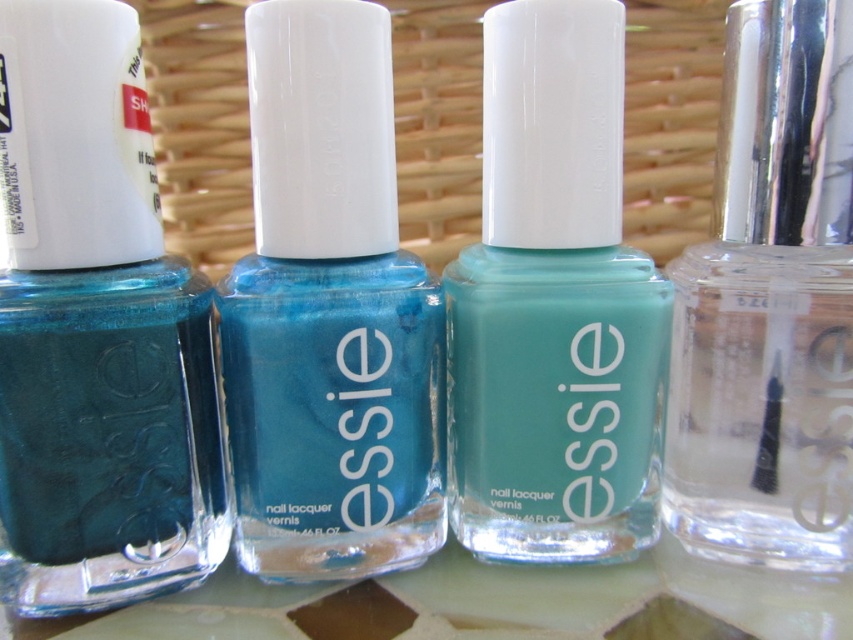
Question: Does matte glass nail polish at center appear under clear glass nail polish at right?

Choices:
 (A) no
 (B) yes

Answer: (B)

Question: Which object is positioned farthest from the clear glass nail polish at right?

Choices:
 (A) teal glossy nail polish at left
 (B) matte glass nail polish at center

Answer: (A)

Question: Which of the following is the farthest from the observer?

Choices:
 (A) (115, 348)
 (B) (811, 324)
 (C) (305, 570)

Answer: (C)

Question: Is matte glass nail polish at center to the left of clear glass nail polish at right from the viewer's perspective?

Choices:
 (A) no
 (B) yes

Answer: (B)

Question: From the image, what is the correct spatial relationship of teal glossy nail polish at left in relation to shiny teal nail polish at center?

Choices:
 (A) right
 (B) left

Answer: (B)

Question: Based on their relative distances, which object is farther from the shiny teal nail polish at center?

Choices:
 (A) matte glass nail polish at center
 (B) teal glossy nail polish at left
 (C) clear glass nail polish at right

Answer: (C)